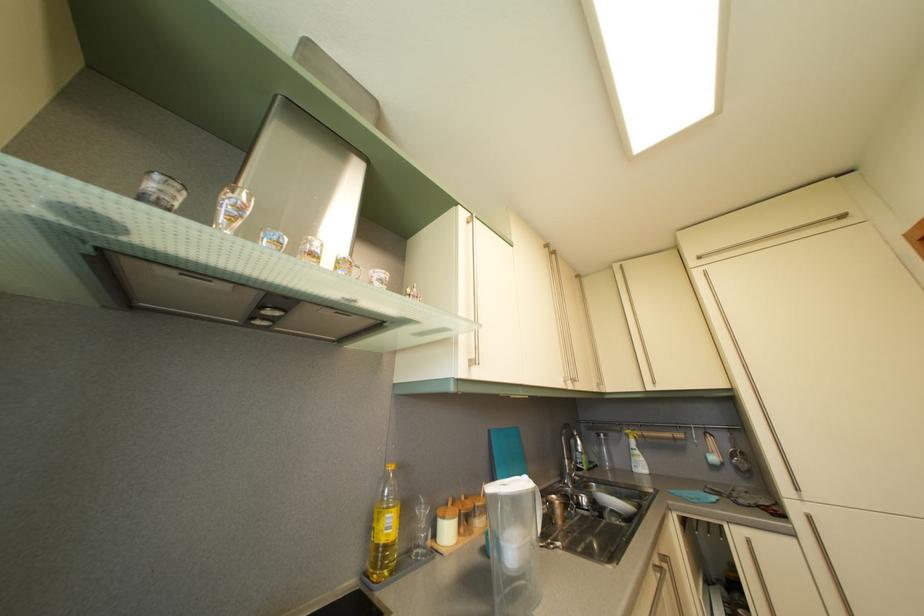
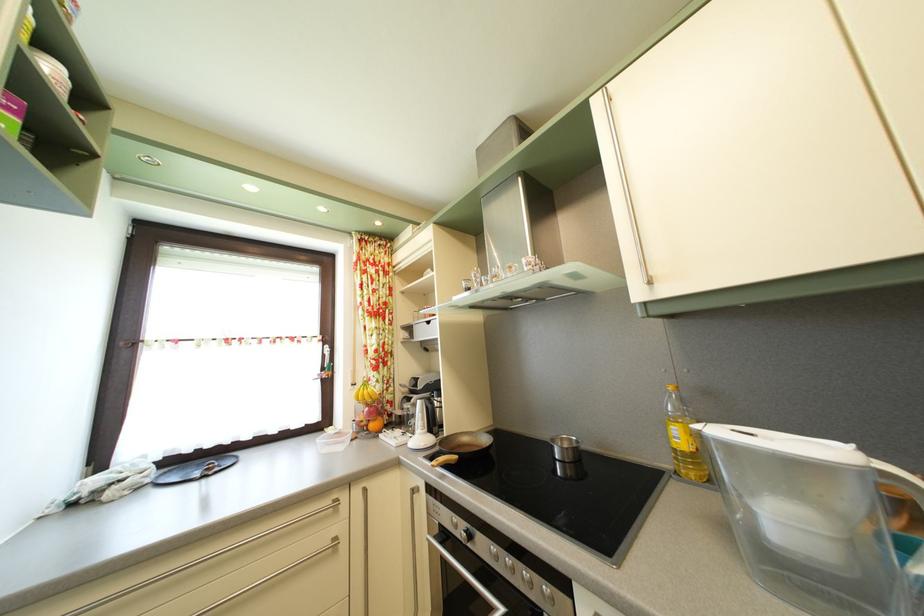
Find the pixel in the second image that matches point (409, 475) in the first image.

(715, 400)